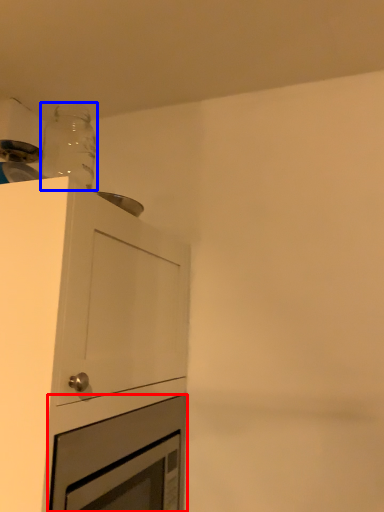
Question: Which object appears farthest to the camera in this image, oven (highlighted by a red box) or bottle (highlighted by a blue box)?

Choices:
 (A) oven
 (B) bottle

Answer: (B)